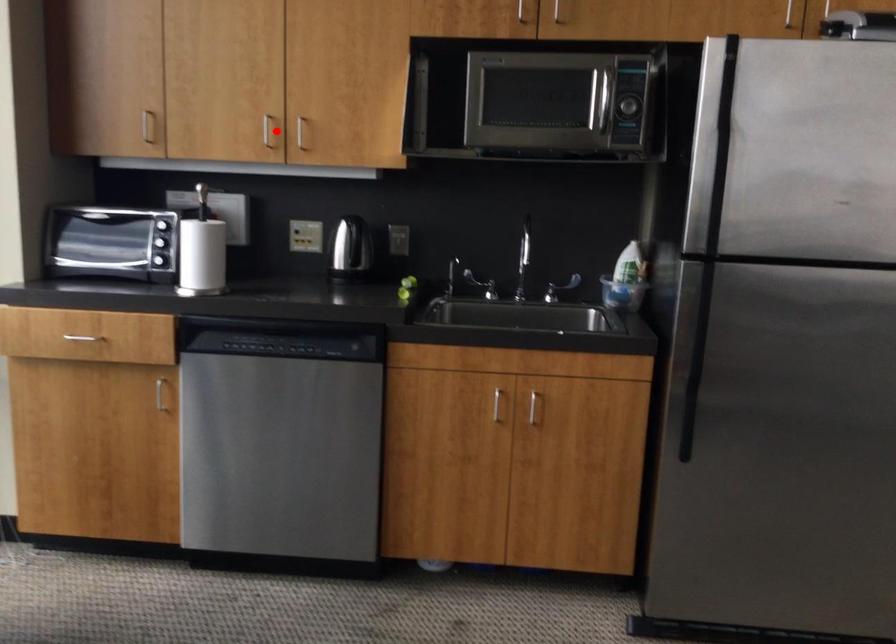
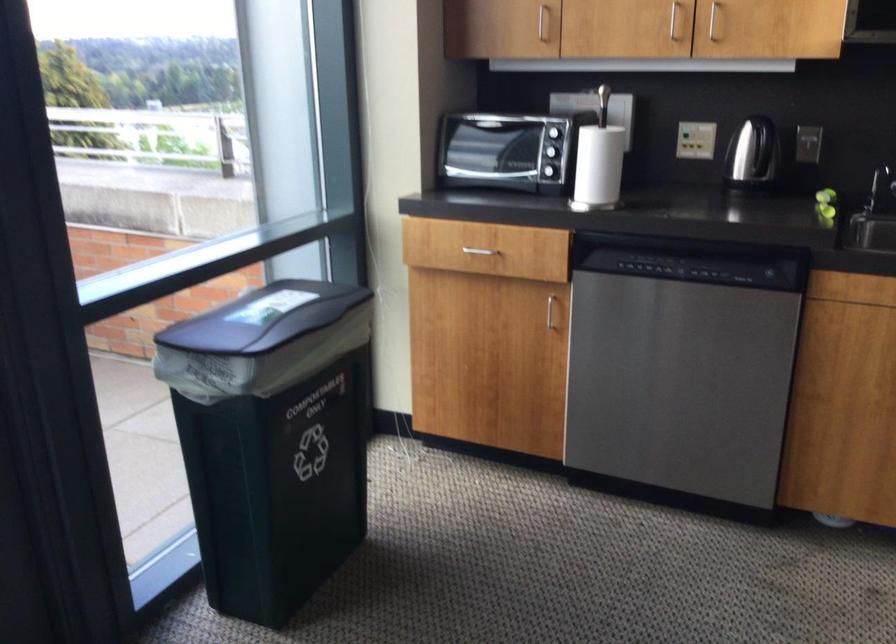
The point at the highlighted location is marked in the first image. Where is the corresponding point in the second image?

(673, 20)